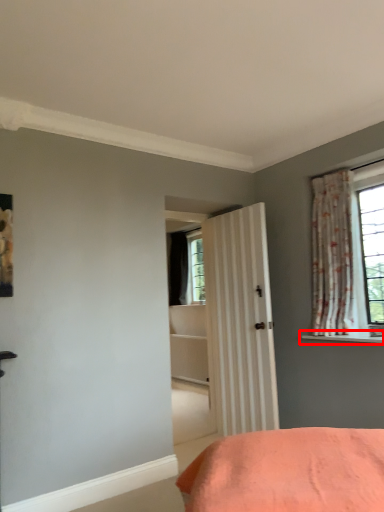
Question: Where is window sill (annotated by the red box) located in relation to curtain in the image?

Choices:
 (A) right
 (B) left

Answer: (A)